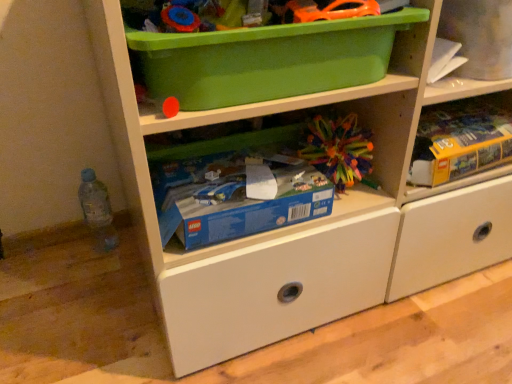
Question: Does multicolored plastic ball at center, the first toy positioned from the bottom, have a lesser height compared to green plastic storage box at upper center, marked as the 1th storage box in a top-to-bottom arrangement?

Choices:
 (A) no
 (B) yes

Answer: (B)

Question: Considering the relative sizes of multicolored plastic ball at center, which is the first toy in back-to-front order, and green plastic storage box at upper center, marked as the 1th storage box in a top-to-bottom arrangement, in the image provided, is multicolored plastic ball at center, which is the first toy in back-to-front order, bigger than green plastic storage box at upper center, marked as the 1th storage box in a top-to-bottom arrangement,?

Choices:
 (A) no
 (B) yes

Answer: (A)

Question: Does multicolored plastic ball at center, the first toy positioned from the bottom, have a smaller size compared to green plastic storage box at upper center, marked as the 1th storage box in a top-to-bottom arrangement?

Choices:
 (A) yes
 (B) no

Answer: (A)

Question: Does multicolored plastic ball at center, the 2th toy when ordered from front to back, have a lesser width compared to green plastic storage box at upper center, arranged as the 2th storage box when ordered from the bottom?

Choices:
 (A) no
 (B) yes

Answer: (B)

Question: From the image's perspective, is multicolored plastic ball at center, the first toy positioned from the bottom, under green plastic storage box at upper center, marked as the 1th storage box in a top-to-bottom arrangement?

Choices:
 (A) yes
 (B) no

Answer: (A)

Question: From the image's perspective, is multicolored plastic ball at center, the 2th toy when ordered from front to back, over green plastic storage box at upper center, marked as the 1th storage box in a top-to-bottom arrangement?

Choices:
 (A) yes
 (B) no

Answer: (B)

Question: From a real-world perspective, does orange plastic toy car at upper center, the 2th toy from the bottom, sit lower than multicolored plastic ball at center, the 2th toy when ordered from front to back?

Choices:
 (A) no
 (B) yes

Answer: (A)

Question: Is orange plastic toy car at upper center, the first toy viewed from the front, with multicolored plastic ball at center, which is the first toy in back-to-front order?

Choices:
 (A) no
 (B) yes

Answer: (A)

Question: Considering the relative positions of orange plastic toy car at upper center, which appears as the second toy when viewed from the back, and multicolored plastic ball at center, the first toy positioned from the bottom, in the image provided, is orange plastic toy car at upper center, which appears as the second toy when viewed from the back, to the left of multicolored plastic ball at center, the first toy positioned from the bottom, from the viewer's perspective?

Choices:
 (A) no
 (B) yes

Answer: (B)

Question: Does orange plastic toy car at upper center, the 2th toy from the bottom, appear on the right side of multicolored plastic ball at center, the 2th toy when ordered from front to back?

Choices:
 (A) no
 (B) yes

Answer: (A)

Question: Would you say orange plastic toy car at upper center, which appears as the second toy when viewed from the back, is outside multicolored plastic ball at center, which is the first toy in back-to-front order?

Choices:
 (A) yes
 (B) no

Answer: (A)

Question: From the image's perspective, does orange plastic toy car at upper center, arranged as the 1th toy when viewed from the top, appear lower than multicolored plastic ball at center, marked as the 2th toy in a top-to-bottom arrangement?

Choices:
 (A) no
 (B) yes

Answer: (A)

Question: From the image's perspective, is yellow cardboard box at upper right located above multicolored plastic ball at center, the 2th toy when ordered from front to back?

Choices:
 (A) yes
 (B) no

Answer: (A)